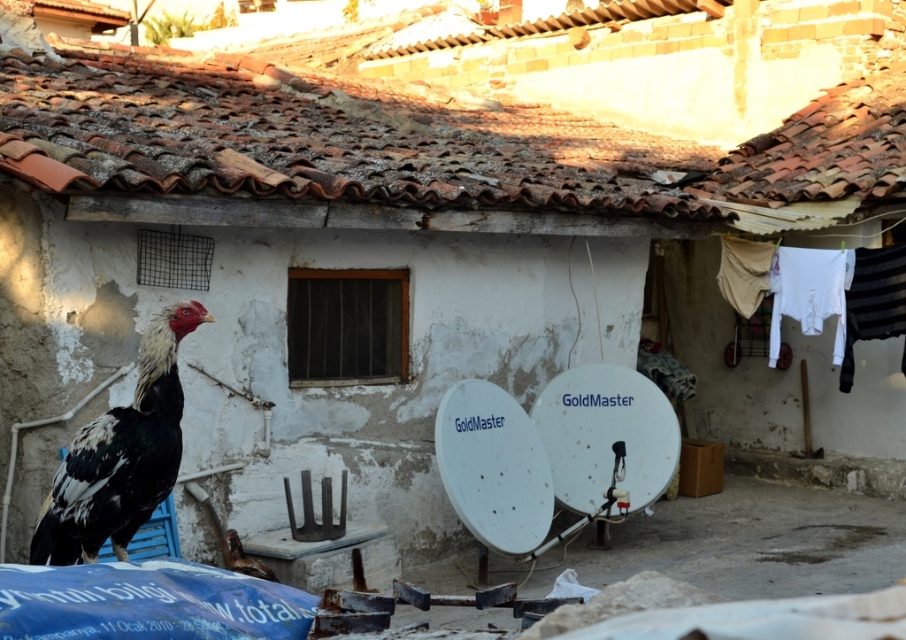
Is brown tile roof at upper center further to camera compared to brown feathered chicken at lower center?

No, it is not.

Does brown tile roof at upper center appear under brown feathered chicken at lower center?

Actually, brown tile roof at upper center is above brown feathered chicken at lower center.

Which is behind, point (686, 200) or point (246, 557)?

The point (686, 200) is behind.

Identify the location of brown tile roof at upper center. (421, 145).

Between speckled feathered rooster at left and brown feathered chicken at lower center, which one appears on the right side from the viewer's perspective?

brown feathered chicken at lower center

This screenshot has height=640, width=906. Identify the location of speckled feathered rooster at left. (120, 456).

Does brown tile roof at upper center appear over speckled feathered rooster at left?

Yes, brown tile roof at upper center is above speckled feathered rooster at left.

Between brown tile roof at upper center and speckled feathered rooster at left, which one is positioned lower?

speckled feathered rooster at left is below.

Which is in front, point (860, 188) or point (162, 328)?

Point (162, 328)

You are a GUI agent. You are given a task and a screenshot of the screen. Output one action in this format:
    pyautogui.click(x=<x>, y=<y>)
    Task: Click on the brown tile roof at upper center
    Image resolution: width=906 pixels, height=640 pixels.
    Given the screenshot: What is the action you would take?
    pyautogui.click(x=421, y=145)